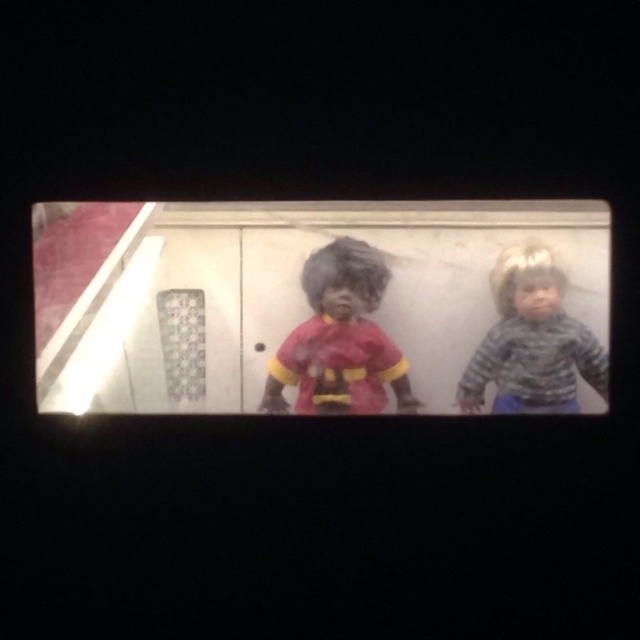
Between matte red fabric doll at center and camouflage sweater at right, which one has more height?

Standing taller between the two is matte red fabric doll at center.

Can you confirm if matte red fabric doll at center is positioned below camouflage sweater at right?

Incorrect, matte red fabric doll at center is not positioned below camouflage sweater at right.

This screenshot has height=640, width=640. What do you see at coordinates (339, 339) in the screenshot?
I see `matte red fabric doll at center` at bounding box center [339, 339].

What are the coordinates of `matte red fabric doll at center` in the screenshot? It's located at (339, 339).